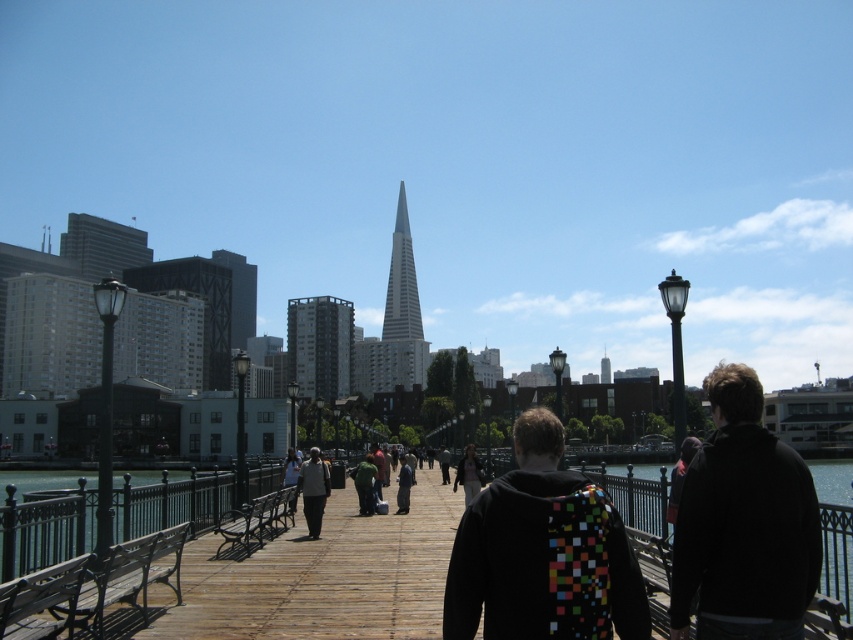
You are a photographer standing on the boardwalk and want to take a photo of both the green matte jacket at center and the dark green fabric jacket at center. Which jacket should you adjust your camera to focus on first if you want to capture them both in the frame?

The green matte jacket at center is positioned on the left side of dark green fabric jacket at center, so you should focus on the dark green fabric jacket at center first to ensure both are in the frame.

You are a photographer wanting to capture both the light brown leather jacket at center and the green fabric jacket at center in the same frame. Which jacket should you focus on first to ensure both are in the shot?

The light brown leather jacket at center is smaller than the green fabric jacket at center, so you should focus on the green fabric jacket at center first to ensure both are in the shot.

You are standing at the entrance of the boardwalk and want to find the multicolored pixelated backpack at center. According to the coordinates provided, in which direction should you walk to locate it?

The multicolored pixelated backpack at center is located at coordinates point (543, 552), so you should walk forward along the boardwalk to reach it since it is positioned ahead of your starting point at the entrance.